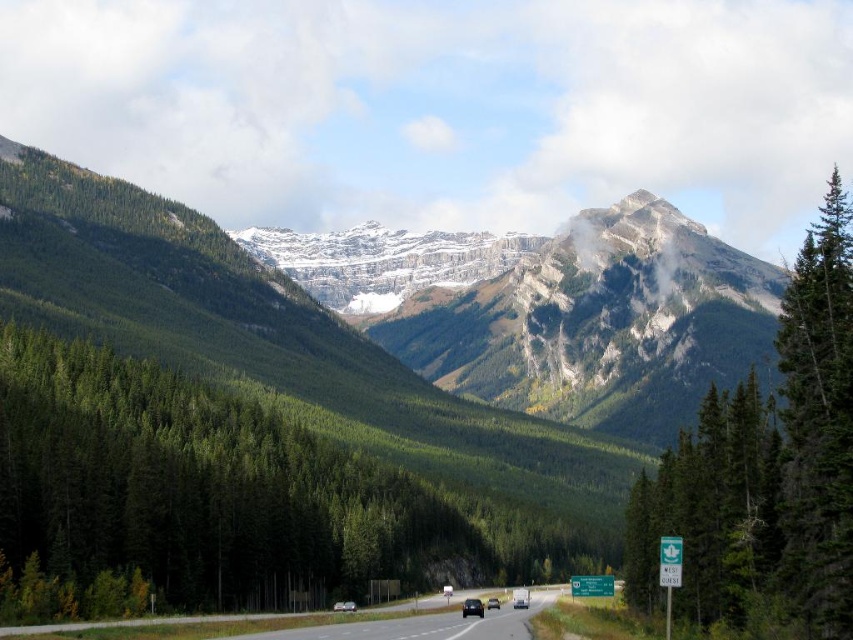
Does green forested mountain range at upper center appear over asphalt road at center?

Correct, green forested mountain range at upper center is located above asphalt road at center.

Is green forested mountain range at upper center taller than asphalt road at center?

Indeed, green forested mountain range at upper center has a greater height compared to asphalt road at center.

Between point (426, 339) and point (503, 620), which one is positioned in front?

Point (503, 620)

Where is `green forested mountain range at upper center`? The image size is (853, 640). green forested mountain range at upper center is located at coordinates coord(486,296).

Can you confirm if green textured tree at upper right is smaller than green textured pine tree at right?

Incorrect, green textured tree at upper right is not smaller in size than green textured pine tree at right.

Is green textured tree at upper right above green textured pine tree at right?

Actually, green textured tree at upper right is below green textured pine tree at right.

Does point (726, 435) lie behind point (815, 372)?

Yes, point (726, 435) is behind point (815, 372).

You are a GUI agent. You are given a task and a screenshot of the screen. Output one action in this format:
    pyautogui.click(x=<x>, y=<y>)
    Task: Click on the green textured tree at upper right
    The height and width of the screenshot is (640, 853).
    Given the screenshot: What is the action you would take?
    pyautogui.click(x=766, y=467)

Is green forested mountain range at upper center to the left of green textured tree at upper right from the viewer's perspective?

Yes, green forested mountain range at upper center is to the left of green textured tree at upper right.

Is green forested mountain range at upper center positioned at the back of green textured tree at upper right?

That is True.

Is point (582, 353) in front of point (817, 525)?

No, it is behind (817, 525).

Where is `green forested mountain range at upper center`? This screenshot has width=853, height=640. green forested mountain range at upper center is located at coordinates 486,296.